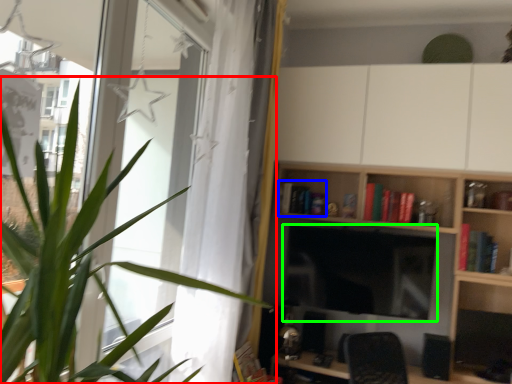
Question: Based on their relative distances, which object is nearer to houseplant (highlighted by a red box)? Choose from book (highlighted by a blue box) and computer monitor (highlighted by a green box).

Choices:
 (A) book
 (B) computer monitor

Answer: (B)